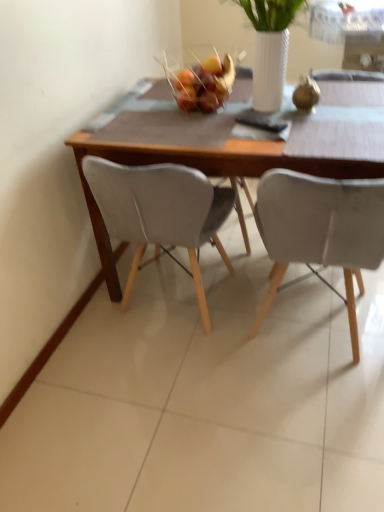
Find the location of a particular element. The height and width of the screenshot is (512, 384). wooden table at center is located at coordinates (225, 153).

Consider the image. Measure the distance between point (296,196) and camera.

Point (296,196) and camera are 1.10 meters apart from each other.

Find the location of a particular element. matte gray chair at center, marked as the 2th chair in a right-to-left arrangement is located at coordinates (161, 212).

The image size is (384, 512). What are the coordinates of `wooden table at center` in the screenshot? It's located at (225, 153).

In terms of size, does glossy plastic fruit basket at center appear bigger or smaller than white matte chair at right, which is the first chair in right-to-left order?

In the image, glossy plastic fruit basket at center appears to be smaller than white matte chair at right, which is the first chair in right-to-left order.

How different are the orientations of glossy plastic fruit basket at center and white matte chair at right, which is the first chair in right-to-left order, in degrees?

89.6 degrees.

From a real-world perspective, which is physically below, glossy plastic fruit basket at center or white matte chair at right, which is the first chair in right-to-left order?

white matte chair at right, which is the first chair in right-to-left order.

Could you measure the distance between glossy plastic fruit basket at center and white matte chair at right, marked as the second chair in a left-to-right arrangement?

The distance of glossy plastic fruit basket at center from white matte chair at right, marked as the second chair in a left-to-right arrangement, is 24.51 inches.

Is matte gray chair at center, marked as the 2th chair in a right-to-left arrangement, inside wooden table at center?

Absolutely, matte gray chair at center, marked as the 2th chair in a right-to-left arrangement, is inside wooden table at center.

Considering the relative positions of wooden table at center and matte gray chair at center, marked as the 2th chair in a right-to-left arrangement, in the image provided, is wooden table at center in front of matte gray chair at center, marked as the 2th chair in a right-to-left arrangement,?

Yes, wooden table at center is closer to the viewer.

Is wooden table at center at the left side of matte gray chair at center, marked as the 2th chair in a right-to-left arrangement?

Incorrect, wooden table at center is not on the left side of matte gray chair at center, marked as the 2th chair in a right-to-left arrangement.

Based on the photo, can you tell me how much white matte chair at right, which is the first chair in right-to-left order, and glossy plastic fruit basket at center differ in facing direction?

The facing directions of white matte chair at right, which is the first chair in right-to-left order, and glossy plastic fruit basket at center are 89.6 degrees apart.

From a real-world perspective, who is located lower, white matte chair at right, marked as the second chair in a left-to-right arrangement, or glossy plastic fruit basket at center?

white matte chair at right, marked as the second chair in a left-to-right arrangement.

Between white matte chair at right, which is the first chair in right-to-left order, and glossy plastic fruit basket at center, which one has larger size?

With larger size is white matte chair at right, which is the first chair in right-to-left order.

Is white matte chair at right, which is the first chair in right-to-left order, taller or shorter than glossy plastic fruit basket at center?

white matte chair at right, which is the first chair in right-to-left order, is taller than glossy plastic fruit basket at center.

How far apart are matte gray chair at center, marked as the 2th chair in a right-to-left arrangement, and glossy plastic fruit basket at center?

matte gray chair at center, marked as the 2th chair in a right-to-left arrangement, is 17.89 inches away from glossy plastic fruit basket at center.

Identify the location of fruit on the right of matte gray chair at center, placed as the first chair when sorted from left to right. (204, 83).

Looking at this image, considering the positions of objects matte gray chair at center, placed as the first chair when sorted from left to right, and glossy plastic fruit basket at center in the image provided, who is in front, matte gray chair at center, placed as the first chair when sorted from left to right, or glossy plastic fruit basket at center?

Positioned in front is matte gray chair at center, placed as the first chair when sorted from left to right.

From a real-world perspective, is matte gray chair at center, marked as the 2th chair in a right-to-left arrangement, beneath glossy plastic fruit basket at center?

Yes, from a real-world perspective, matte gray chair at center, marked as the 2th chair in a right-to-left arrangement, is under glossy plastic fruit basket at center.

Looking at this image, does white matte chair at right, which is the first chair in right-to-left order, have a lesser height compared to wooden table at center?

No, white matte chair at right, which is the first chair in right-to-left order, is not shorter than wooden table at center.

Based on the photo, which of these two, white matte chair at right, which is the first chair in right-to-left order, or wooden table at center, is thinner?

With smaller width is white matte chair at right, which is the first chair in right-to-left order.

Are white matte chair at right, which is the first chair in right-to-left order, and wooden table at center beside each other?

white matte chair at right, which is the first chair in right-to-left order, and wooden table at center are not in contact.

From a real-world perspective, which is physically above, white matte chair at right, which is the first chair in right-to-left order, or wooden table at center?

In real-world perspective, white matte chair at right, which is the first chair in right-to-left order, is above.

Is wooden table at center inside matte gray chair at center, marked as the 2th chair in a right-to-left arrangement?

No, matte gray chair at center, marked as the 2th chair in a right-to-left arrangement, does not contain wooden table at center.

Where is `chair that is the 1st object located below the wooden table at center (from the image's perspective)`? chair that is the 1st object located below the wooden table at center (from the image's perspective) is located at coordinates (161, 212).

Based on the photo, can you confirm if matte gray chair at center, placed as the first chair when sorted from left to right, is wider than wooden table at center?

No, matte gray chair at center, placed as the first chair when sorted from left to right, is not wider than wooden table at center.

From the image's perspective, which is below, matte gray chair at center, placed as the first chair when sorted from left to right, or wooden table at center?

matte gray chair at center, placed as the first chair when sorted from left to right, is shown below in the image.

From the image's perspective, is white matte chair at right, which is the first chair in right-to-left order, above or below matte gray chair at center, marked as the 2th chair in a right-to-left arrangement?

Based on their image positions, white matte chair at right, which is the first chair in right-to-left order, is located beneath matte gray chair at center, marked as the 2th chair in a right-to-left arrangement.

Is white matte chair at right, marked as the second chair in a left-to-right arrangement, next to matte gray chair at center, marked as the 2th chair in a right-to-left arrangement?

white matte chair at right, marked as the second chair in a left-to-right arrangement, is not next to matte gray chair at center, marked as the 2th chair in a right-to-left arrangement, and they're not touching.

Is white matte chair at right, which is the first chair in right-to-left order, wider or thinner than matte gray chair at center, placed as the first chair when sorted from left to right?

Considering their sizes, white matte chair at right, which is the first chair in right-to-left order, looks broader than matte gray chair at center, placed as the first chair when sorted from left to right.

Who is smaller, white matte chair at right, which is the first chair in right-to-left order, or matte gray chair at center, placed as the first chair when sorted from left to right?

matte gray chair at center, placed as the first chair when sorted from left to right.

From the image's perspective, count 2nd chairs downward from the glossy plastic fruit basket at center and point to it. Please provide its 2D coordinates.

[(320, 230)]

This screenshot has height=512, width=384. Identify the location of chair that is the 1st object above the wooden table at center (from a real-world perspective). (161, 212).

Which object lies further to the anchor point wooden table at center, white matte chair at right, marked as the second chair in a left-to-right arrangement, or matte gray chair at center, marked as the 2th chair in a right-to-left arrangement?

The object further to wooden table at center is white matte chair at right, marked as the second chair in a left-to-right arrangement.

From the image, which object appears to be nearer to white matte chair at right, marked as the second chair in a left-to-right arrangement, wooden table at center or glossy plastic fruit basket at center?

The object closer to white matte chair at right, marked as the second chair in a left-to-right arrangement, is wooden table at center.

When comparing their distances from wooden table at center, does matte gray chair at center, placed as the first chair when sorted from left to right, or glossy plastic fruit basket at center seem closer?

The object closer to wooden table at center is matte gray chair at center, placed as the first chair when sorted from left to right.

When comparing their distances from matte gray chair at center, marked as the 2th chair in a right-to-left arrangement, does white matte chair at right, which is the first chair in right-to-left order, or wooden table at center seem closer?

The object closer to matte gray chair at center, marked as the 2th chair in a right-to-left arrangement, is wooden table at center.

Which object lies nearer to the anchor point glossy plastic fruit basket at center, matte gray chair at center, marked as the 2th chair in a right-to-left arrangement, or white matte chair at right, marked as the second chair in a left-to-right arrangement?

matte gray chair at center, marked as the 2th chair in a right-to-left arrangement.

Looking at the image, which one is located closer to glossy plastic fruit basket at center, wooden table at center or white matte chair at right, marked as the second chair in a left-to-right arrangement?

wooden table at center is closer to glossy plastic fruit basket at center.

Considering their positions, is wooden table at center positioned closer to white matte chair at right, which is the first chair in right-to-left order, than matte gray chair at center, marked as the 2th chair in a right-to-left arrangement?

wooden table at center.

Based on their spatial positions, is glossy plastic fruit basket at center or wooden table at center further from white matte chair at right, which is the first chair in right-to-left order?

Among the two, glossy plastic fruit basket at center is located further to white matte chair at right, which is the first chair in right-to-left order.

At what (x,y) coordinates should I click in order to perform the action: click on table between glossy plastic fruit basket at center and matte gray chair at center, placed as the first chair when sorted from left to right, in the up-down direction. Please return your answer as a coordinate pair (x, y). Image resolution: width=384 pixels, height=512 pixels. Looking at the image, I should click on (225, 153).

Identify the location of table between glossy plastic fruit basket at center and white matte chair at right, marked as the second chair in a left-to-right arrangement, vertically. The height and width of the screenshot is (512, 384). (225, 153).

I want to click on table between matte gray chair at center, placed as the first chair when sorted from left to right, and white matte chair at right, marked as the second chair in a left-to-right arrangement, in the horizontal direction, so point(225,153).

Locate an element on the screen. The image size is (384, 512). chair between glossy plastic fruit basket at center and white matte chair at right, marked as the second chair in a left-to-right arrangement, vertically is located at coordinates (161, 212).